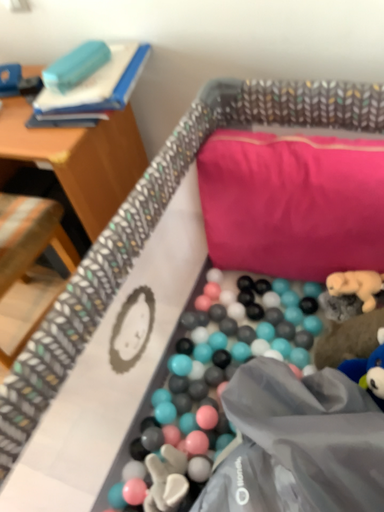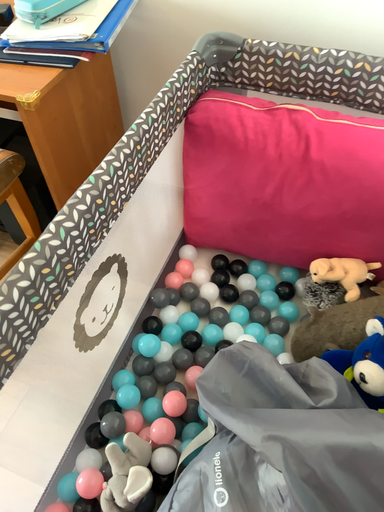
Question: Which way did the camera rotate in the video?

Choices:
 (A) rotated right
 (B) rotated left

Answer: (A)